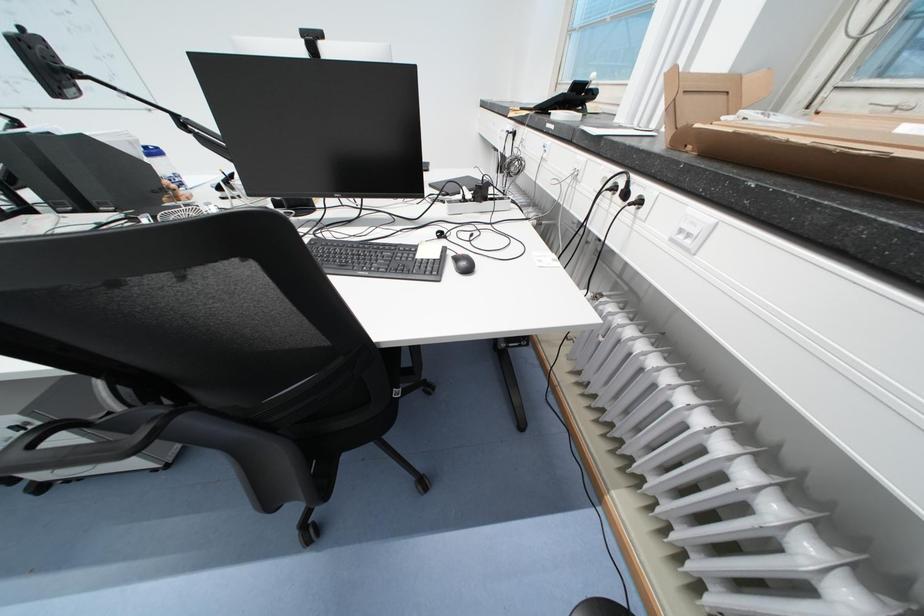
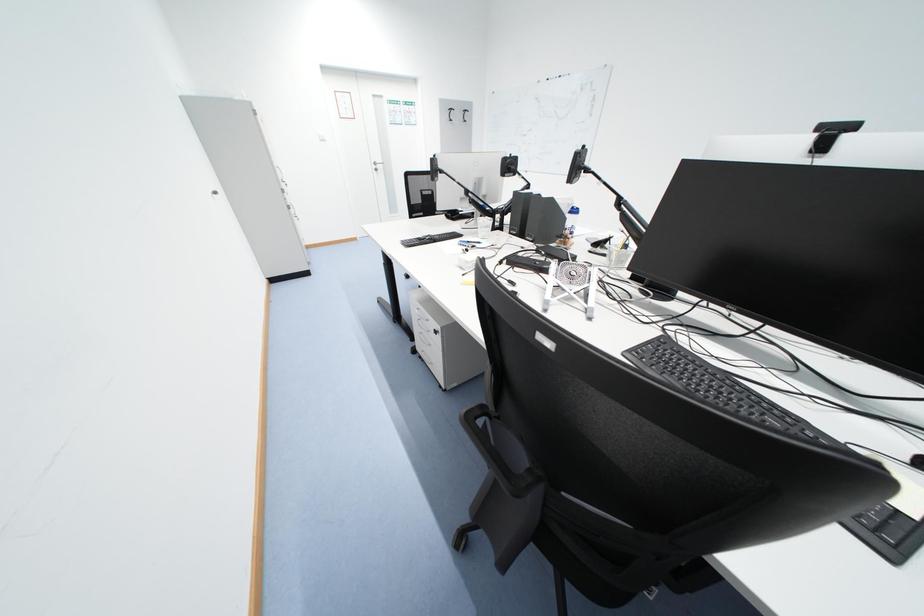
Question: The first image is from the beginning of the video and the second image is from the end. How did the camera likely rotate when shooting the video?

Choices:
 (A) Left
 (B) Right
 (C) Up
 (D) Down

Answer: (A)